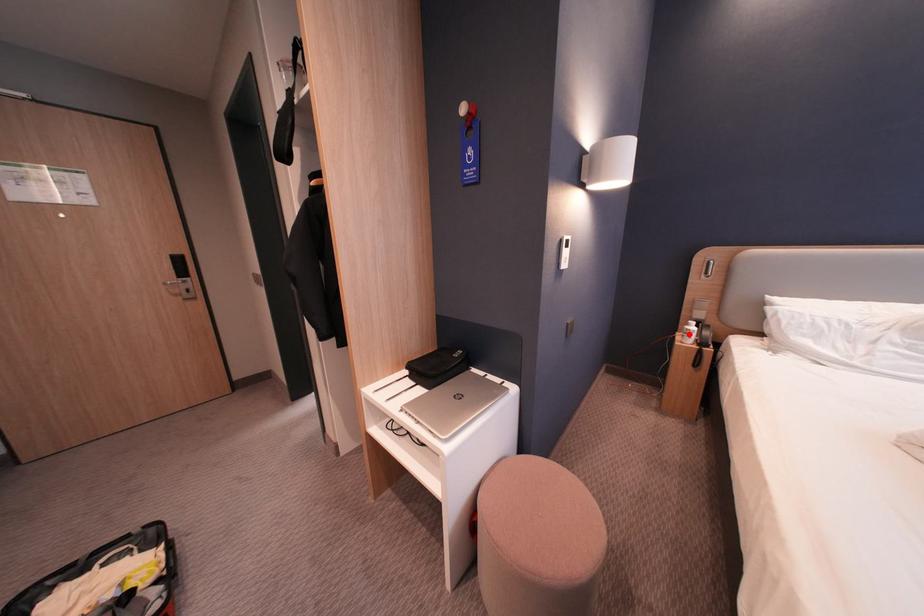
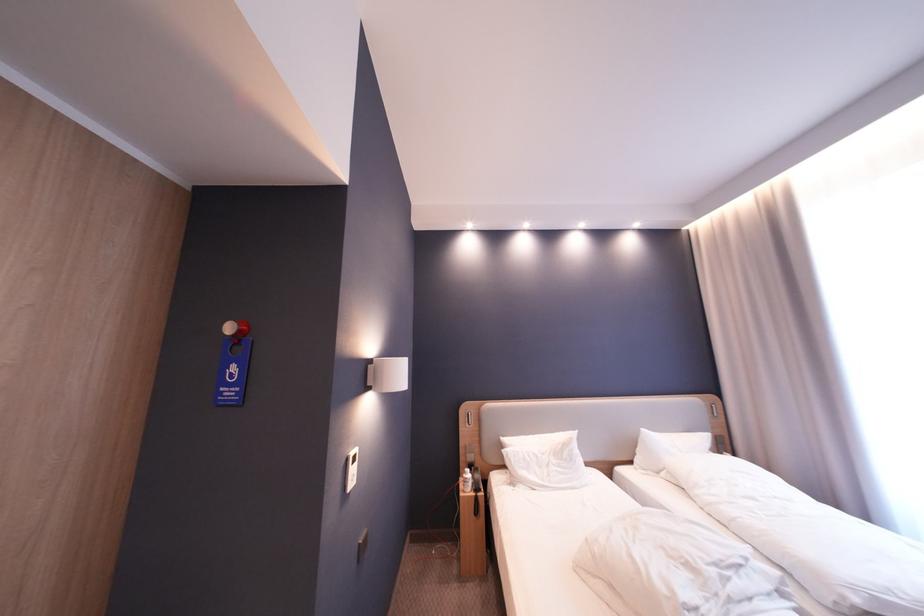
Find the pixel in the second image that matches the highlighted location in the first image.

(471, 479)